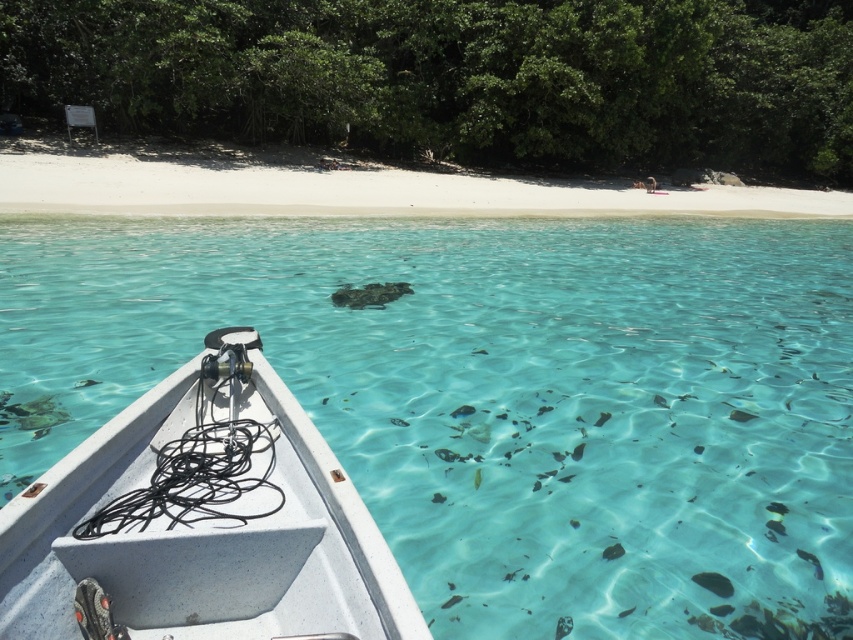
Question: Considering the real-world distances, which object is closest to the clear water at center?

Choices:
 (A) white speckled plastic boat at center
 (B) white sand beach at upper center

Answer: (A)

Question: Can you confirm if clear water at center is bigger than white speckled plastic boat at center?

Choices:
 (A) no
 (B) yes

Answer: (B)

Question: Based on their relative distances, which object is farther from the white sand beach at upper center?

Choices:
 (A) clear water at center
 (B) white speckled plastic boat at center

Answer: (B)

Question: Is clear water at center smaller than white speckled plastic boat at center?

Choices:
 (A) no
 (B) yes

Answer: (A)

Question: Which is nearer to the white speckled plastic boat at center?

Choices:
 (A) white sand beach at upper center
 (B) clear water at center

Answer: (B)

Question: Is white speckled plastic boat at center to the left of white sand beach at upper center from the viewer's perspective?

Choices:
 (A) yes
 (B) no

Answer: (A)